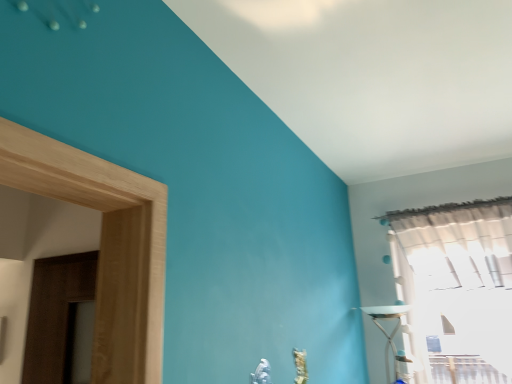
This screenshot has width=512, height=384. What do you see at coordinates (457, 287) in the screenshot? I see `white sheer curtain at upper right` at bounding box center [457, 287].

The width and height of the screenshot is (512, 384). Identify the location of white sheer curtain at upper right. (457, 287).

This screenshot has height=384, width=512. Find the location of `white sheer curtain at upper right`. white sheer curtain at upper right is located at coordinates (457, 287).